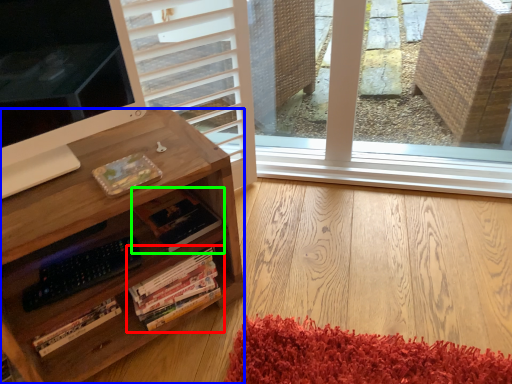
Question: Which is farther away from book (highlighted by a red box)? desk (highlighted by a blue box) or book (highlighted by a green box)?

Choices:
 (A) desk
 (B) book

Answer: (A)